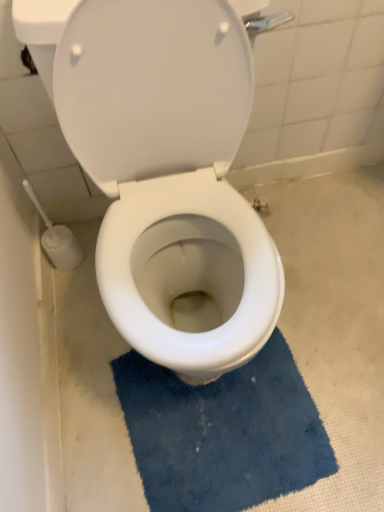
Question: Does blue textured bath mat at lower center have a lesser width compared to white glossy toilet at center?

Choices:
 (A) yes
 (B) no

Answer: (A)

Question: Is blue textured bath mat at lower center further to camera compared to white glossy toilet at center?

Choices:
 (A) yes
 (B) no

Answer: (A)

Question: Considering the relative sizes of blue textured bath mat at lower center and white glossy toilet at center in the image provided, is blue textured bath mat at lower center taller than white glossy toilet at center?

Choices:
 (A) yes
 (B) no

Answer: (B)

Question: Is blue textured bath mat at lower center placed right next to white glossy toilet at center?

Choices:
 (A) yes
 (B) no

Answer: (B)

Question: Does blue textured bath mat at lower center lie in front of white glossy toilet at center?

Choices:
 (A) yes
 (B) no

Answer: (B)

Question: Visually, is blue textured bath mat at lower center positioned to the left or to the right of white glossy toilet at center?

Choices:
 (A) right
 (B) left

Answer: (A)

Question: From a real-world perspective, is blue textured bath mat at lower center physically located above or below white glossy toilet at center?

Choices:
 (A) above
 (B) below

Answer: (B)

Question: Relative to white glossy toilet at center, is blue textured bath mat at lower center in front or behind?

Choices:
 (A) behind
 (B) front

Answer: (A)

Question: Considering the positions of point (137, 402) and point (119, 280), is point (137, 402) closer or farther from the camera than point (119, 280)?

Choices:
 (A) farther
 (B) closer

Answer: (A)

Question: In terms of width, does blue textured bath mat at lower center look wider or thinner when compared to white plastic toilet brush at lower left?

Choices:
 (A) wide
 (B) thin

Answer: (A)

Question: Do you think blue textured bath mat at lower center is within white plastic toilet brush at lower left, or outside of it?

Choices:
 (A) inside
 (B) outside

Answer: (B)

Question: In the image, is blue textured bath mat at lower center on the left side or the right side of white plastic toilet brush at lower left?

Choices:
 (A) right
 (B) left

Answer: (A)

Question: From a real-world perspective, is blue textured bath mat at lower center positioned above or below white plastic toilet brush at lower left?

Choices:
 (A) below
 (B) above

Answer: (A)

Question: From the image's perspective, is white glossy toilet at center above or below white plastic toilet brush at lower left?

Choices:
 (A) below
 (B) above

Answer: (B)

Question: Is white glossy toilet at center inside the boundaries of white plastic toilet brush at lower left, or outside?

Choices:
 (A) inside
 (B) outside

Answer: (B)